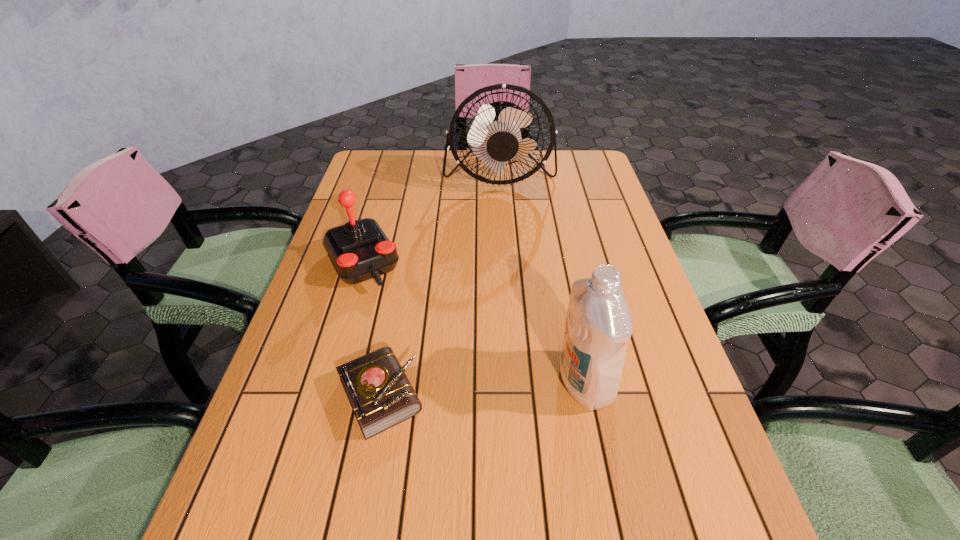
The width and height of the screenshot is (960, 540). I want to click on fan, so click(498, 134).

Where is `detergent`? detergent is located at coordinates (x=598, y=327).

Where is `joystick`? This screenshot has height=540, width=960. joystick is located at coordinates (359, 250).

Identify the location of the second farthest object. The height and width of the screenshot is (540, 960). (359, 250).

At what (x,y) coordinates should I click in order to perform the action: click on the shortest object. Please return your answer as a coordinate pair (x, y). This screenshot has height=540, width=960. Looking at the image, I should click on (381, 396).

Identify the location of vacant space located 0.210m in front of the farthest object, directing airflow. (504, 241).

Where is `vacant region located 0.380m on the left of the detergent`? Image resolution: width=960 pixels, height=540 pixels. vacant region located 0.380m on the left of the detergent is located at coordinates (365, 382).

At what (x,y) coordinates should I click in order to perform the action: click on vacant space positioned 0.110m on the back of the third tallest object. Please return your answer as a coordinate pair (x, y). The image size is (960, 540). Looking at the image, I should click on (377, 212).

Identify the location of vacant area situated 0.140m on the right of the diary. The width and height of the screenshot is (960, 540). (497, 395).

You are a GUI agent. You are given a task and a screenshot of the screen. Output one action in this format:
    pyautogui.click(x=<x>, y=<y>)
    Task: Click on the object that is at the far edge
    The image size is (960, 540).
    Given the screenshot: What is the action you would take?
    pyautogui.click(x=498, y=134)